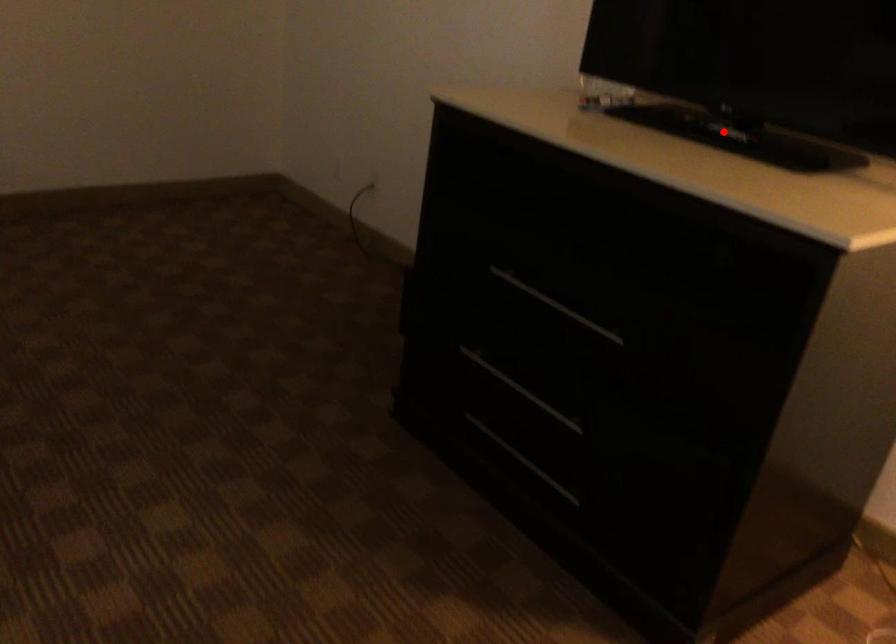
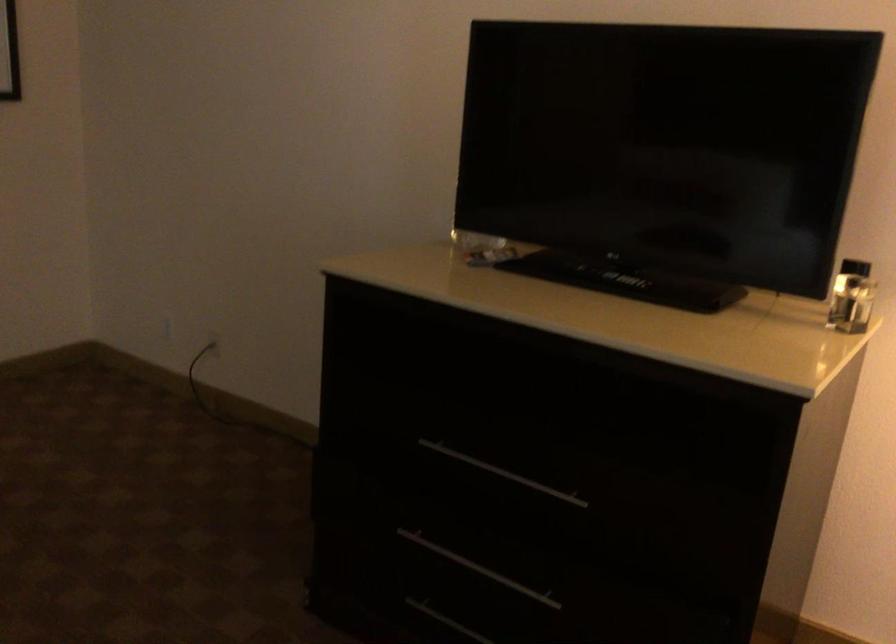
The point at the highlighted location is marked in the first image. Where is the corresponding point in the second image?

(625, 279)